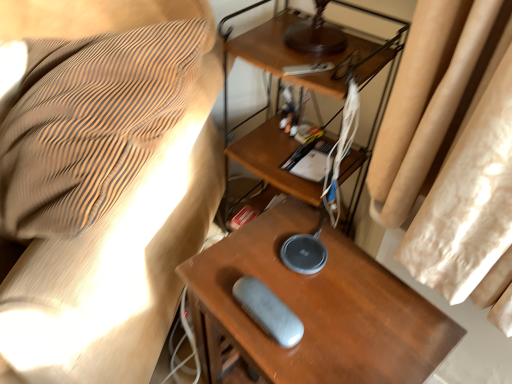
Question: Does gray fabric pouch at lower center come in front of gray matte speaker at center?

Choices:
 (A) no
 (B) yes

Answer: (B)

Question: Considering the relative sizes of gray fabric pouch at lower center and gray matte speaker at center in the image provided, is gray fabric pouch at lower center bigger than gray matte speaker at center?

Choices:
 (A) no
 (B) yes

Answer: (B)

Question: From the image's perspective, does gray fabric pouch at lower center appear higher than gray matte speaker at center?

Choices:
 (A) yes
 (B) no

Answer: (A)

Question: From a real-world perspective, is gray fabric pouch at lower center on top of gray matte speaker at center?

Choices:
 (A) yes
 (B) no

Answer: (A)

Question: Is gray fabric pouch at lower center smaller than gray matte speaker at center?

Choices:
 (A) yes
 (B) no

Answer: (B)

Question: Would you say gray matte speaker at center is part of gray fabric pouch at lower center's contents?

Choices:
 (A) no
 (B) yes

Answer: (A)

Question: Is gray matte speaker at center positioned behind gray fabric pouch at lower center?

Choices:
 (A) yes
 (B) no

Answer: (A)

Question: Could you tell me if gray matte speaker at center is facing gray fabric pouch at lower center?

Choices:
 (A) no
 (B) yes

Answer: (A)

Question: Is gray matte speaker at center outside gray fabric pouch at lower center?

Choices:
 (A) yes
 (B) no

Answer: (A)

Question: From a real-world perspective, is gray matte speaker at center physically above gray fabric pouch at lower center?

Choices:
 (A) no
 (B) yes

Answer: (A)

Question: Can you confirm if gray matte speaker at center is bigger than gray fabric pouch at lower center?

Choices:
 (A) yes
 (B) no

Answer: (B)

Question: Is gray matte speaker at center wider than gray fabric pouch at lower center?

Choices:
 (A) yes
 (B) no

Answer: (B)

Question: Are gray fabric pouch at lower center and wooden table at center located far from each other?

Choices:
 (A) yes
 (B) no

Answer: (B)